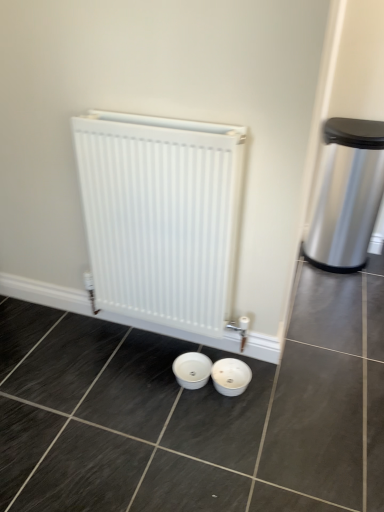
Question: From a real-world perspective, is white glossy basin at center on top of white matte radiator at center?

Choices:
 (A) no
 (B) yes

Answer: (A)

Question: Is white glossy basin at center positioned in front of white matte radiator at center?

Choices:
 (A) yes
 (B) no

Answer: (B)

Question: From the image's perspective, is white glossy basin at center on white matte radiator at center?

Choices:
 (A) no
 (B) yes

Answer: (A)

Question: Does white glossy basin at center have a greater height compared to white matte radiator at center?

Choices:
 (A) no
 (B) yes

Answer: (A)

Question: Is white glossy basin at center looking in the opposite direction of white matte radiator at center?

Choices:
 (A) yes
 (B) no

Answer: (B)

Question: Is white glossy basin at center thinner than white matte radiator at center?

Choices:
 (A) no
 (B) yes

Answer: (A)

Question: Considering the relative positions of white matte radiator at center and white glossy basin at center in the image provided, is white matte radiator at center in front of white glossy basin at center?

Choices:
 (A) no
 (B) yes

Answer: (B)

Question: Is white matte radiator at center far away from white glossy basin at center?

Choices:
 (A) no
 (B) yes

Answer: (A)

Question: Could white glossy basin at center be considered to be inside white matte radiator at center?

Choices:
 (A) no
 (B) yes

Answer: (A)

Question: Is white matte radiator at center not within white glossy basin at center?

Choices:
 (A) yes
 (B) no

Answer: (A)

Question: From the image's perspective, would you say white matte radiator at center is positioned over white glossy basin at center?

Choices:
 (A) yes
 (B) no

Answer: (A)

Question: Can you confirm if white matte radiator at center is shorter than white glossy basin at center?

Choices:
 (A) no
 (B) yes

Answer: (A)

Question: Can you confirm if polished stainless steel trash can at right is thinner than white matte radiator at center?

Choices:
 (A) no
 (B) yes

Answer: (A)